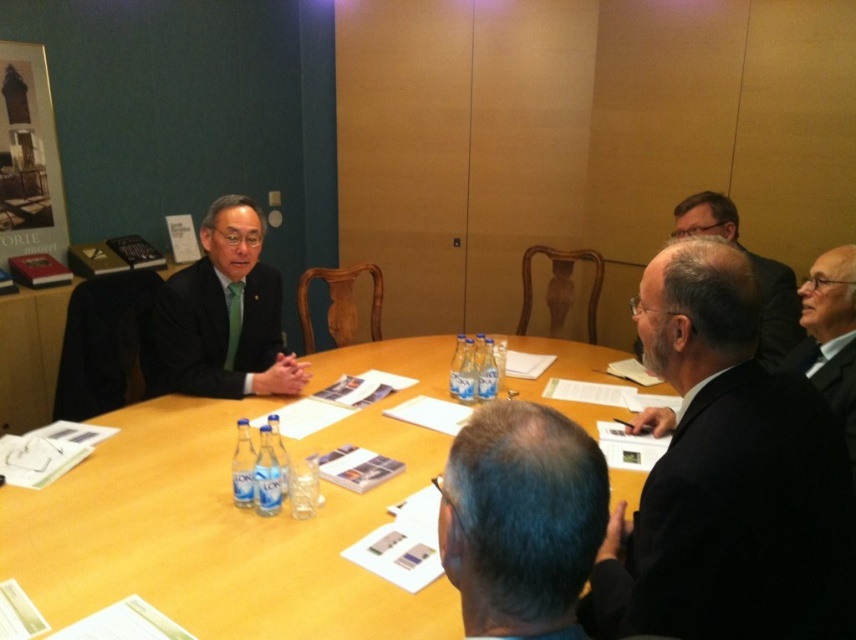
Question: Which object is the closest to the wooden at center?

Choices:
 (A) black matte suit at lower right
 (B) wooden table at center

Answer: (B)

Question: Which object is the closest to the matte black suit at upper right?

Choices:
 (A) gray hair at center
 (B) black matte suit at lower right
 (C) black suit at center
 (D) wooden at center

Answer: (B)

Question: Which point appears closest to the camera in this image?

Choices:
 (A) (187, 362)
 (B) (40, 566)
 (C) (854, 582)

Answer: (C)

Question: Does matte black suit at center have a smaller size compared to wooden table at center?

Choices:
 (A) yes
 (B) no

Answer: (B)

Question: Can you confirm if matte black suit at center is positioned to the right of wooden table at center?

Choices:
 (A) yes
 (B) no

Answer: (A)

Question: Is gray hair at center thinner than matte black suit at upper right?

Choices:
 (A) yes
 (B) no

Answer: (A)